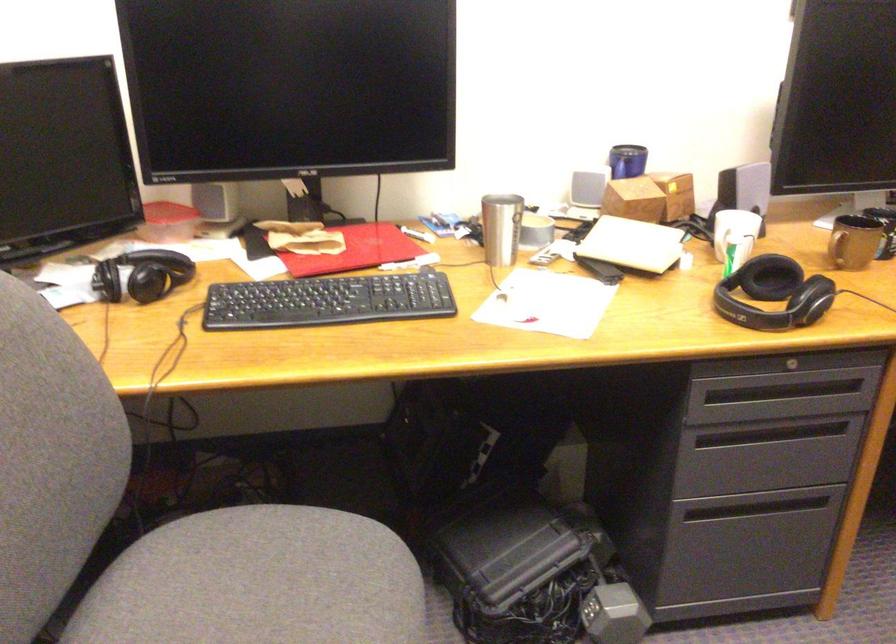
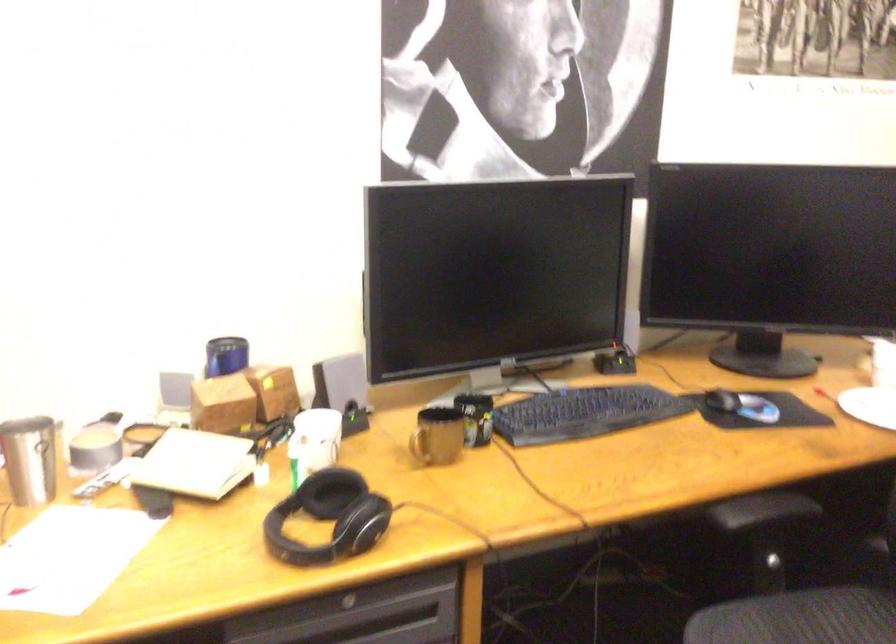
Question: The images are taken continuously from a first-person perspective. In which direction are you moving?

Choices:
 (A) Left
 (B) Right
 (C) Forward
 (D) Backward

Answer: (B)